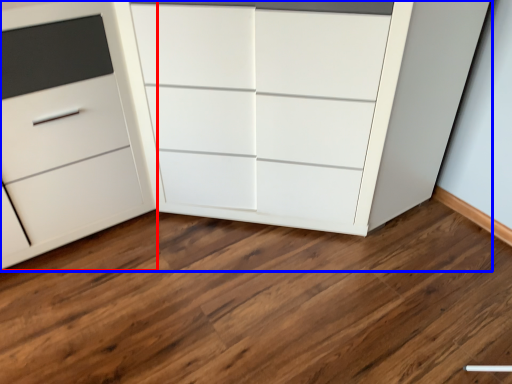
Question: Which object is closer to the camera taking this photo, chest of drawers (highlighted by a red box) or chest of drawers (highlighted by a blue box)?

Choices:
 (A) chest of drawers
 (B) chest of drawers

Answer: (B)